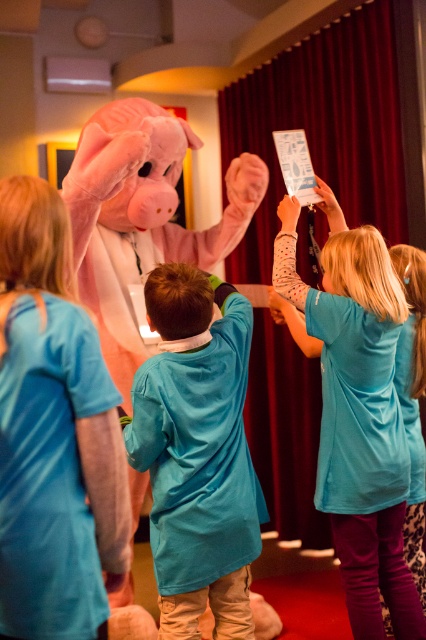
Question: Which point is farther to the camera?

Choices:
 (A) velvet red curtain at upper center
 (B) blue fabric dress at center

Answer: (A)

Question: Does blue cotton shirt at center have a larger size compared to blue fabric dress at center?

Choices:
 (A) no
 (B) yes

Answer: (A)

Question: Among these objects, which one is farthest from the camera?

Choices:
 (A) blue cotton shirt at center
 (B) blue fabric dress at center
 (C) velvet red curtain at upper center
 (D) pink plush costume at left

Answer: (C)

Question: Among these points, which one is farthest from the camera?

Choices:
 (A) (252, 124)
 (B) (85, 624)

Answer: (A)

Question: Does velvet red curtain at upper center have a larger size compared to pink plush costume at left?

Choices:
 (A) no
 (B) yes

Answer: (B)

Question: Is pink plush costume at left positioned before blue cotton shirt at center?

Choices:
 (A) no
 (B) yes

Answer: (B)